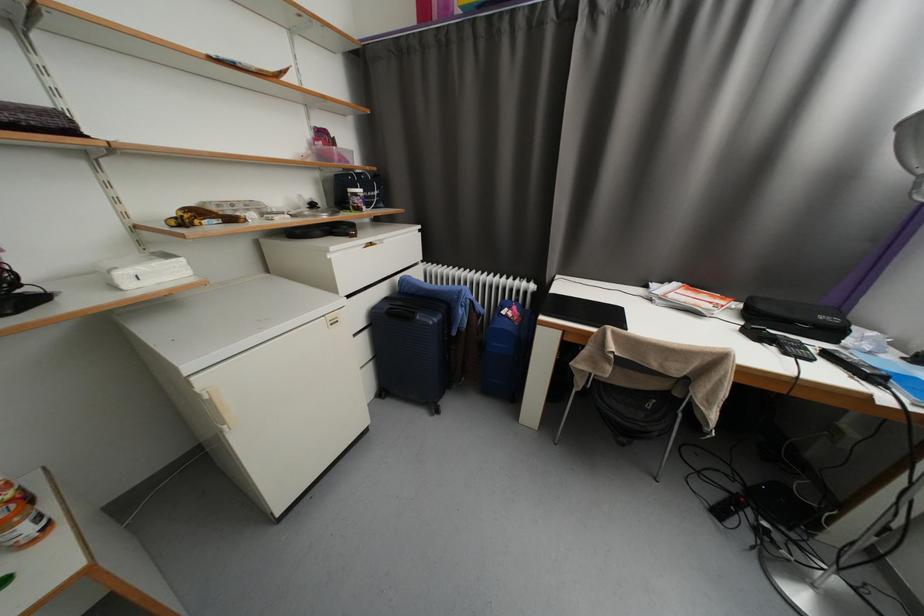
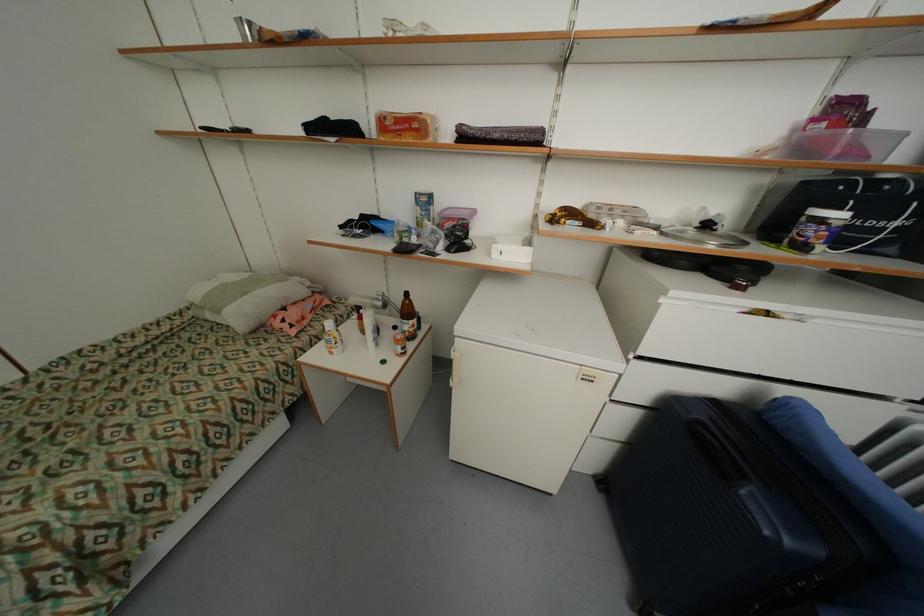
Find the pixel in the second image that matches [134,285] in the first image.

(502, 256)